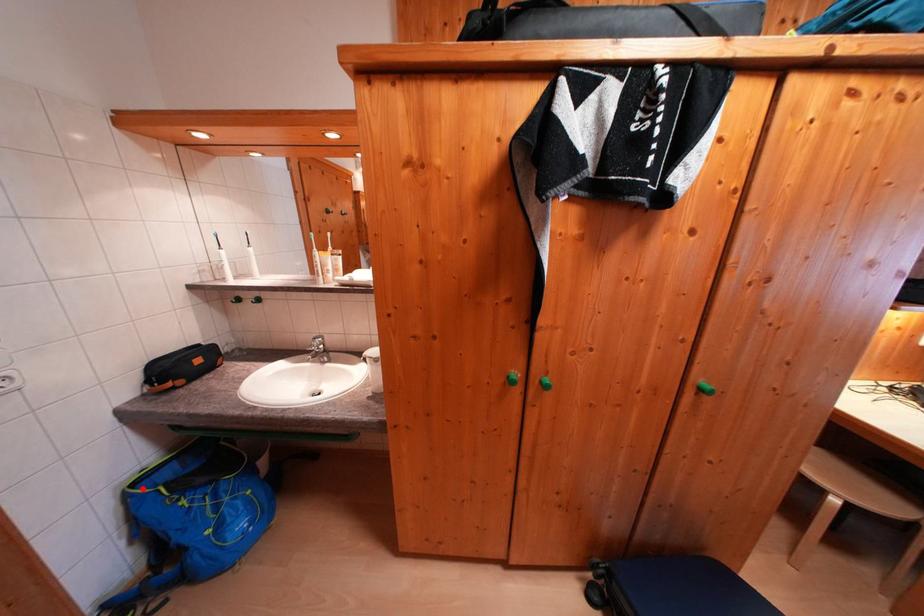
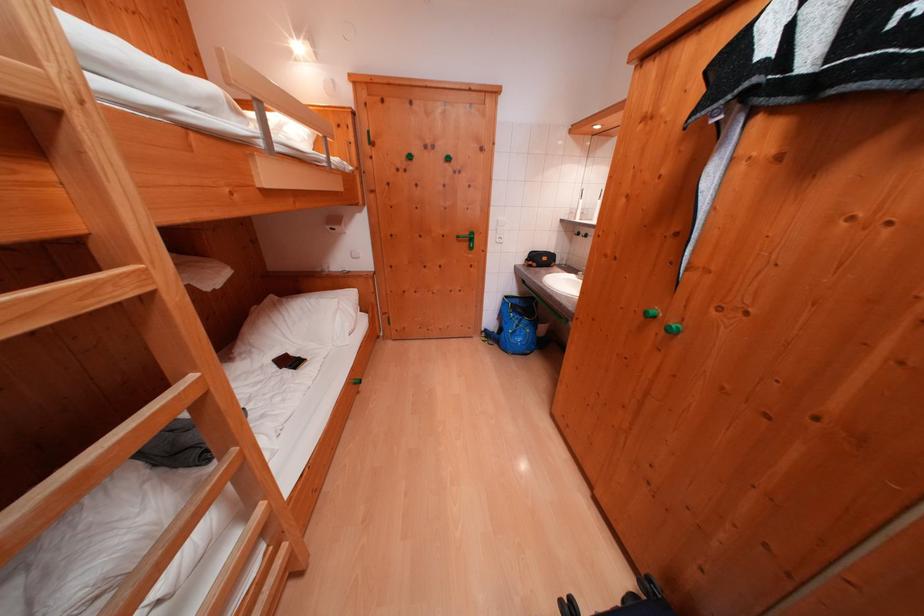
Where in the second image is the point corresponding to the highlighted location from the first image?

(515, 301)